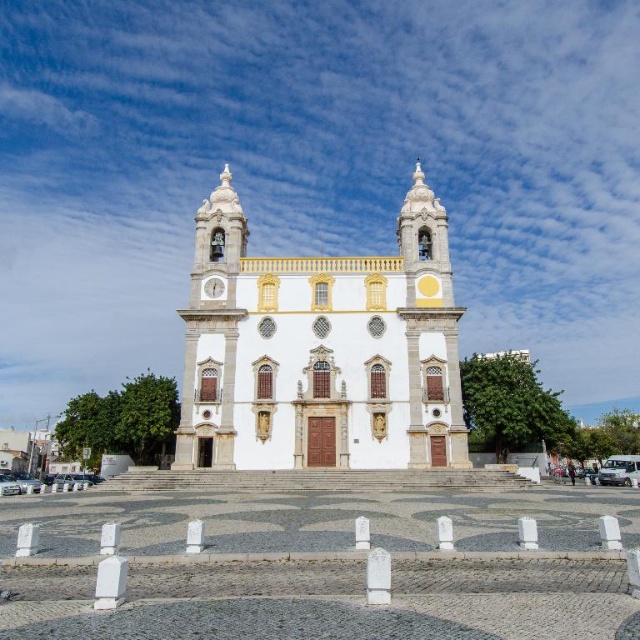
Question: Observing the image, what is the correct spatial positioning of white glossy church at center in reference to white glossy clock at center?

Choices:
 (A) below
 (B) above

Answer: (B)

Question: Does white glossy church at center appear under white glossy clock at center?

Choices:
 (A) no
 (B) yes

Answer: (A)

Question: Where is white glossy church at center located in relation to white glossy clock at center in the image?

Choices:
 (A) left
 (B) right

Answer: (B)

Question: Among these objects, which one is farthest from the camera?

Choices:
 (A) white glossy clock at center
 (B) white glossy church at center

Answer: (A)

Question: Among these objects, which one is nearest to the camera?

Choices:
 (A) white glossy church at center
 (B) white glossy clock at center

Answer: (A)